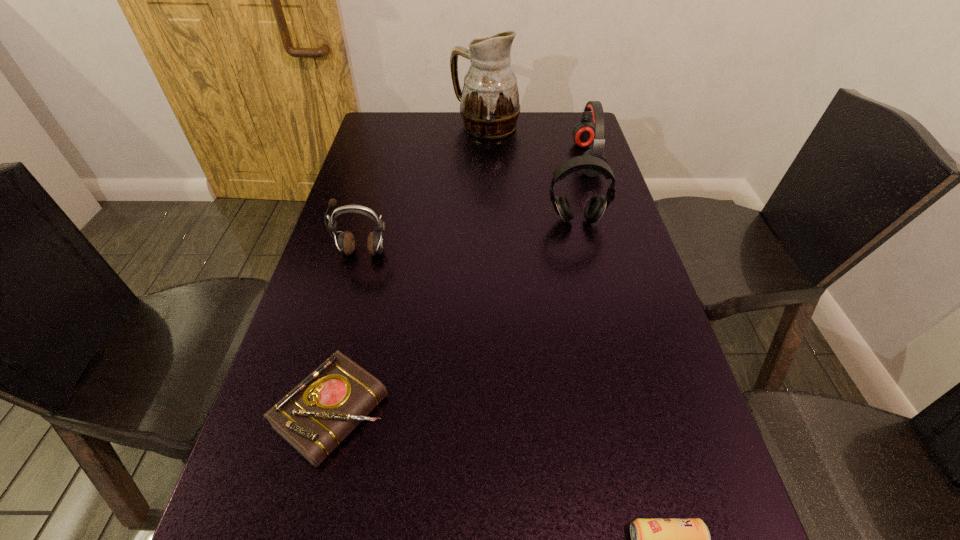
The image size is (960, 540). I want to click on the fourth object from right to left, so click(489, 102).

Where is `the farthest object`? The width and height of the screenshot is (960, 540). the farthest object is located at coordinates (489, 102).

Where is `the second farthest earphone`? The image size is (960, 540). the second farthest earphone is located at coordinates (595, 207).

Where is `the second farthest object`? the second farthest object is located at coordinates (584, 133).

Identify the location of the nearest earphone. The width and height of the screenshot is (960, 540). (345, 243).

You are a GUI agent. You are given a task and a screenshot of the screen. Output one action in this format:
    pyautogui.click(x=<x>, y=<y>)
    Task: Click on the third nearest object
    Image resolution: width=960 pixels, height=540 pixels.
    Given the screenshot: What is the action you would take?
    pyautogui.click(x=345, y=243)

Identify the location of the second nearest object. This screenshot has height=540, width=960. (320, 412).

Identify the location of the second shortest object. (320, 412).

The height and width of the screenshot is (540, 960). Identify the location of vacant space positioned from the spout of the fourth object from right to left. (423, 126).

This screenshot has width=960, height=540. What are the coordinates of `vacant space located from the spout of the fourth object from right to left` in the screenshot? It's located at click(429, 126).